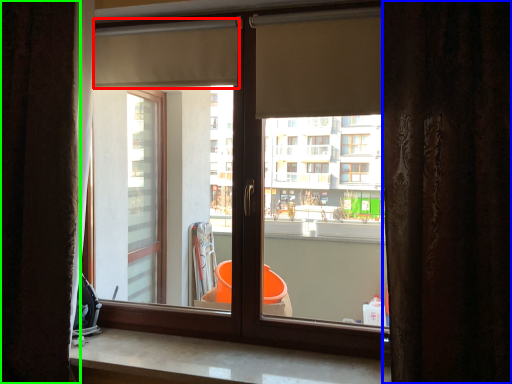
Question: Estimate the real-world distances between objects in this image. Which object is farther from shutter (highlighted by a red box), curtain (highlighted by a blue box) or curtain (highlighted by a green box)?

Choices:
 (A) curtain
 (B) curtain

Answer: (A)